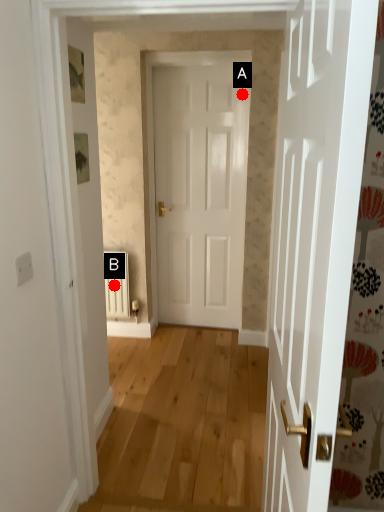
Question: Two points are circled on the image, labeled by A and B beside each circle. Which point is further to the camera?

Choices:
 (A) A is further
 (B) B is further

Answer: (B)